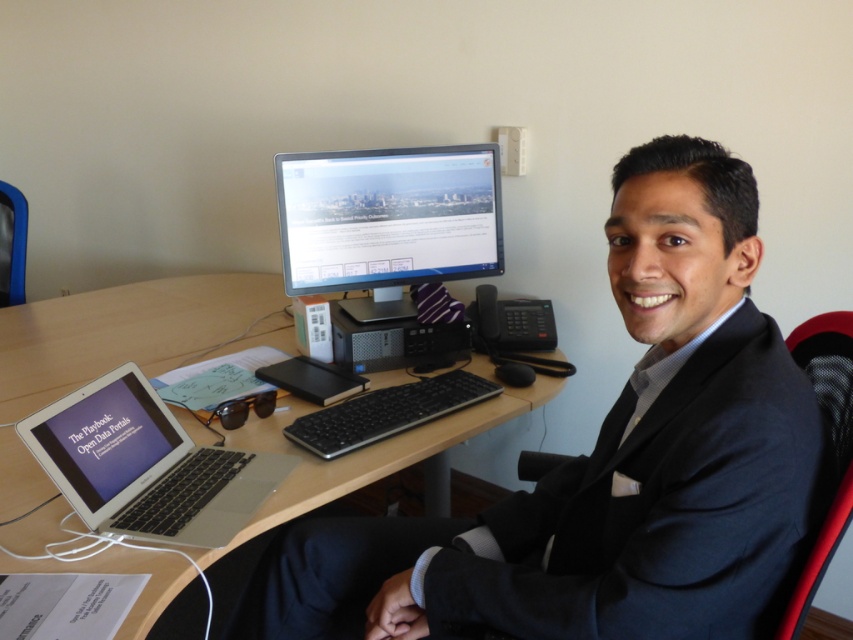
You are standing in front of the desk in the image. There is a point marked at coordinates (x=131, y=332). What is located at that point?

The point at coordinates (x=131, y=332) indicates the wooden desk at center.